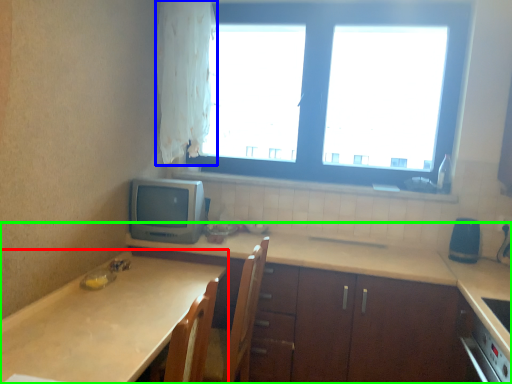
Question: Which is farther away from countertop (highlighted by a red box)? curtain (highlighted by a blue box) or countertop (highlighted by a green box)?

Choices:
 (A) curtain
 (B) countertop

Answer: (A)